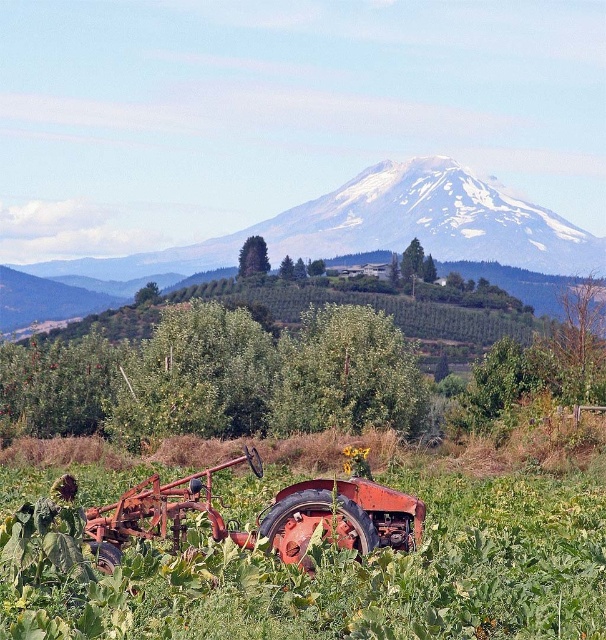
You are standing in the field in the foreground of the scene and want to walk towards the small house nestled among the trees in the midground. There are two points marked on the ground in front of you. Which point, point 1 at coordinates point (107, 476) or point 2 at coordinates point (368, 484), is closer to you as you start your journey towards the house?

Point 1 at coordinates point (107, 476) is closer to you because it is further to the camera than point 2 at coordinates point (368, 484), meaning it is physically nearer to your current position in the foreground.

You are standing in the field and want to hide behind an object to avoid the rain. Which object between the green leafy grass at center and the rusty metal tractor at lower center would provide better coverage?

The green leafy grass at center has a greater height compared to the rusty metal tractor at lower center, so it would provide better coverage to hide from the rain.

You are standing in the field and want to walk towards the house in the orchard. Which object, the green leafy grass at center or the rusty metal tractor at lower center, would you pass first?

The green leafy grass at center is closer to the viewer than the rusty metal tractor at lower center, so you would pass the green leafy grass at center first on your way to the house.